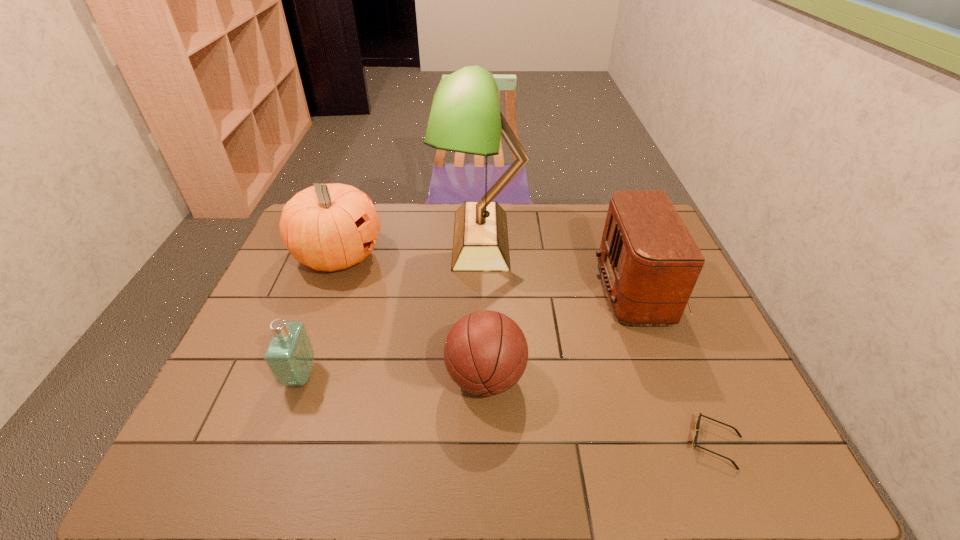
In order to click on the tallest object in this screenshot , I will do `click(465, 116)`.

This screenshot has height=540, width=960. In order to click on pumpkin in this screenshot , I will do `click(328, 227)`.

Locate an element on the screen. Image resolution: width=960 pixels, height=540 pixels. radio receiver is located at coordinates (649, 262).

This screenshot has height=540, width=960. What are the coordinates of `basketball` in the screenshot? It's located at (485, 353).

Where is `perfume`? The height and width of the screenshot is (540, 960). perfume is located at coordinates (289, 356).

Locate an element on the screen. Image resolution: width=960 pixels, height=540 pixels. the nearest object is located at coordinates (699, 417).

At what (x,y) coordinates should I click in order to perform the action: click on the shortest object. Please return your answer as a coordinate pair (x, y). The height and width of the screenshot is (540, 960). Looking at the image, I should click on (699, 417).

This screenshot has width=960, height=540. I want to click on vacant space located on the metallic stand of the table lamp, so pyautogui.click(x=397, y=240).

Image resolution: width=960 pixels, height=540 pixels. What are the coordinates of `vacant region located on the metallic stand of the table lamp` in the screenshot? It's located at (336, 240).

The height and width of the screenshot is (540, 960). What are the coordinates of `vacant area located 0.090m on the metallic stand of the table lamp` in the screenshot? It's located at tap(412, 240).